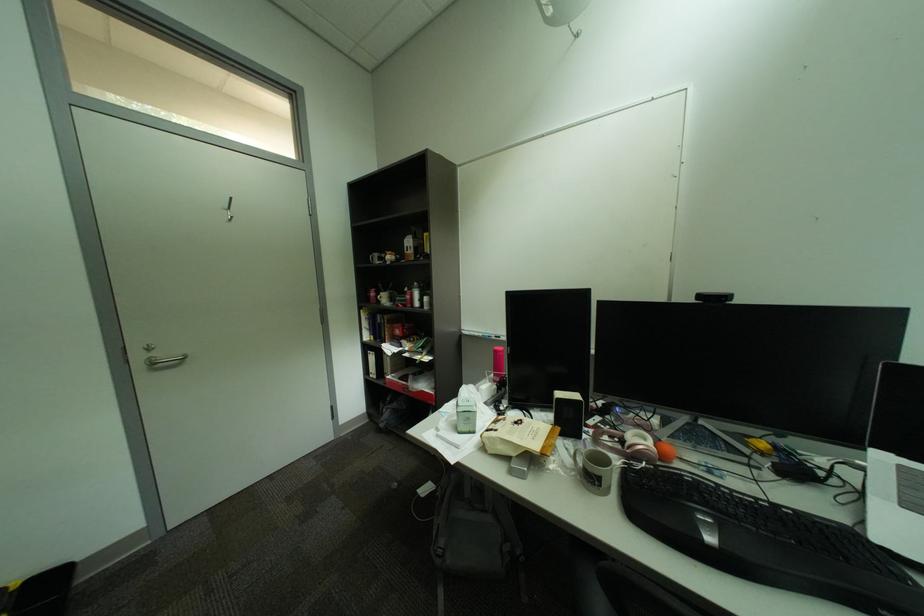
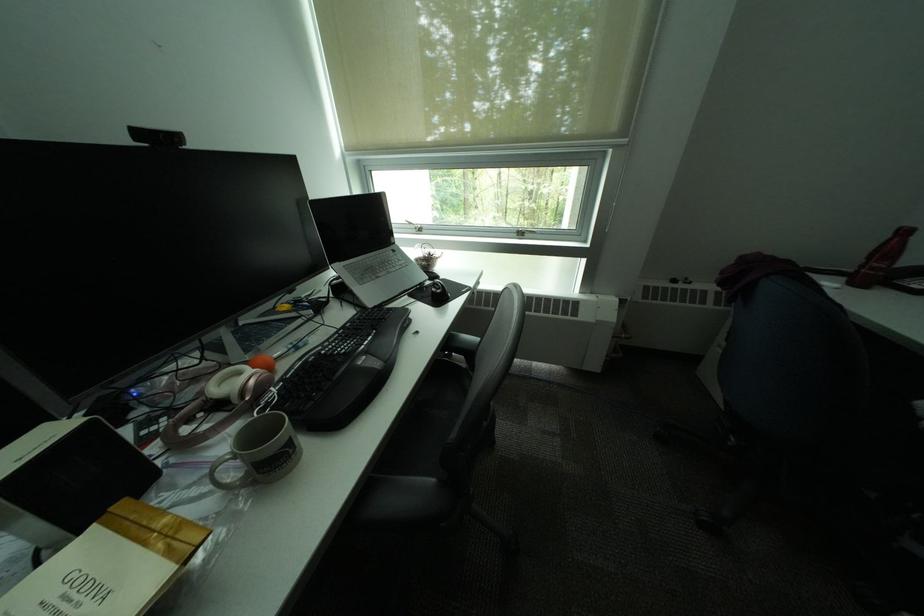
How did the camera likely rotate?

The rotation direction of the camera is right-down.